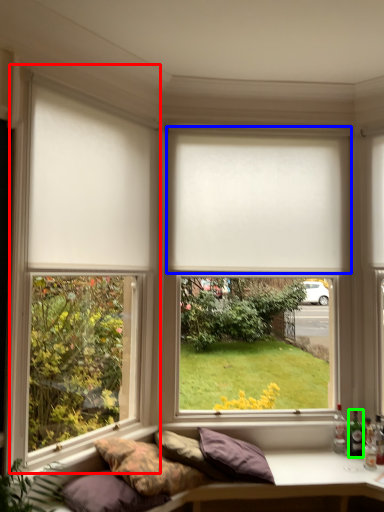
Question: Which object is positioned farthest from window frame (highlighted by a red box)? Select from window blind (highlighted by a blue box) and bottle (highlighted by a green box).

Choices:
 (A) window blind
 (B) bottle

Answer: (B)